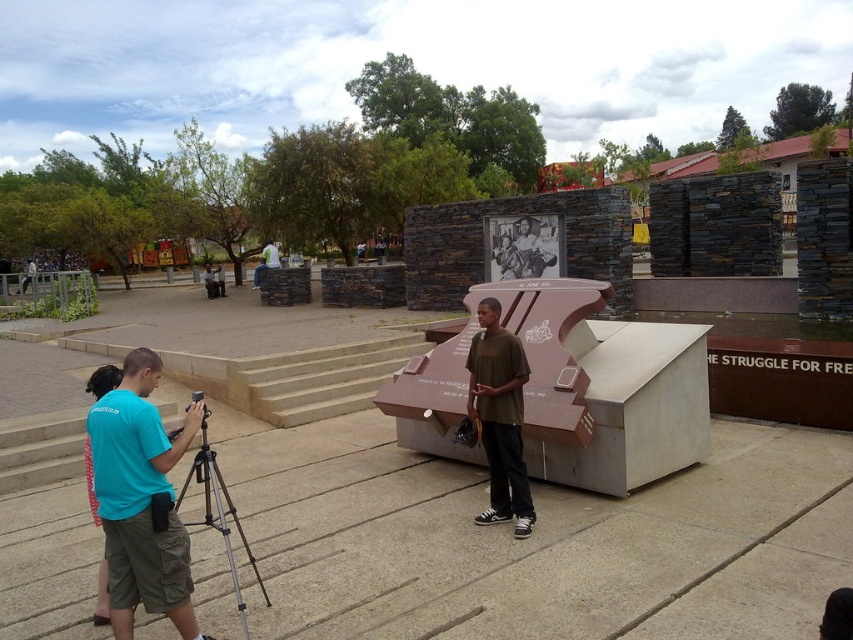
Can you confirm if matte brown shirt at center is taller than silver metallic tripod at lower left?

Yes.

Can you confirm if matte brown shirt at center is positioned below silver metallic tripod at lower left?

Actually, matte brown shirt at center is above silver metallic tripod at lower left.

Locate an element on the screen. The image size is (853, 640). matte brown shirt at center is located at coordinates (500, 417).

Does teal fabric shirt at center have a greater height compared to silver metallic tripod at lower left?

Correct, teal fabric shirt at center is much taller as silver metallic tripod at lower left.

Between teal fabric shirt at center and silver metallic tripod at lower left, which one has less height?

silver metallic tripod at lower left

Between point (111, 408) and point (207, 470), which one is positioned in front?

Point (111, 408) is more forward.

You are a GUI agent. You are given a task and a screenshot of the screen. Output one action in this format:
    pyautogui.click(x=<x>, y=<y>)
    Task: Click on the teal fabric shirt at center
    Image resolution: width=853 pixels, height=640 pixels.
    Given the screenshot: What is the action you would take?
    pyautogui.click(x=141, y=499)

Who is lower down, teal fabric shirt at center or matte brown shirt at center?

teal fabric shirt at center

How much distance is there between teal fabric shirt at center and matte brown shirt at center?

A distance of 2.22 meters exists between teal fabric shirt at center and matte brown shirt at center.

Locate an element on the screen. The image size is (853, 640). teal fabric shirt at center is located at coordinates (141, 499).